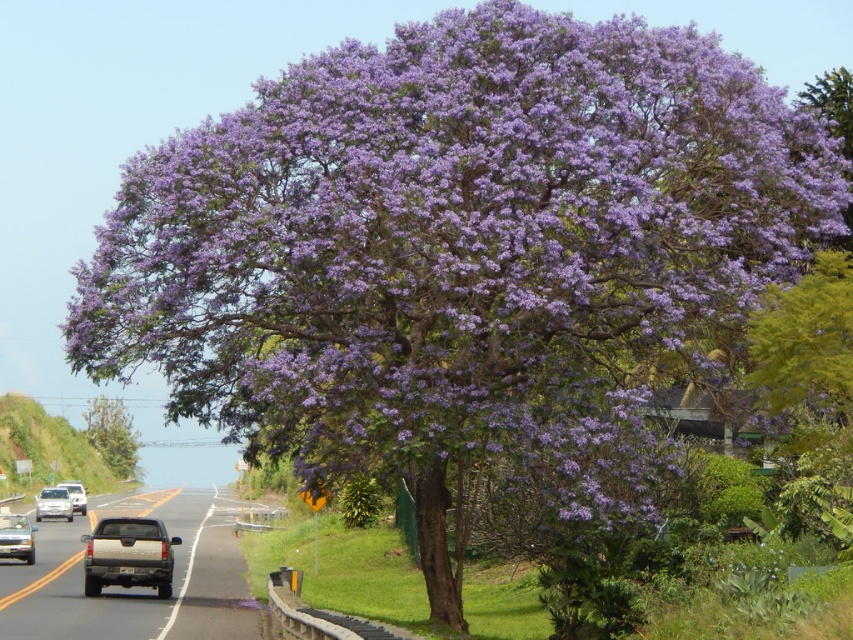
Is point (230, 616) closer to viewer compared to point (120, 529)?

That is True.

Is gray metallic truck at center in front of gold metallic truck at center?

Yes, it is.

Which is behind, point (96, 608) or point (173, 540)?

The point (173, 540) is behind.

Find the location of a particular element. This screenshot has width=853, height=640. gray metallic truck at center is located at coordinates (138, 588).

Which is more to the left, gold metallic truck at center or white matte truck at center?

From the viewer's perspective, white matte truck at center appears more on the left side.

Is gold metallic truck at center above white matte truck at center?

Yes.

This screenshot has height=640, width=853. What are the coordinates of `gold metallic truck at center` in the screenshot? It's located at pyautogui.click(x=128, y=556).

At what (x,y) coordinates should I click in order to perform the action: click on gray metallic truck at center. Please return your answer as a coordinate pair (x, y). Looking at the image, I should click on click(138, 588).

Where is `gray metallic truck at center`? gray metallic truck at center is located at coordinates (138, 588).